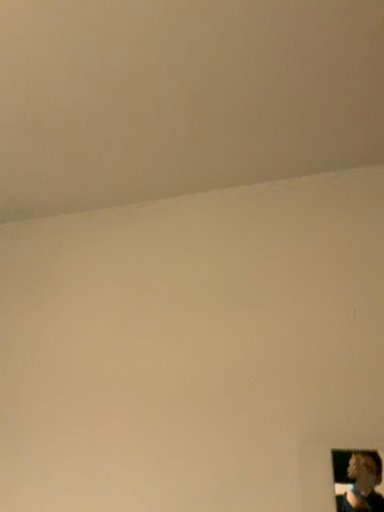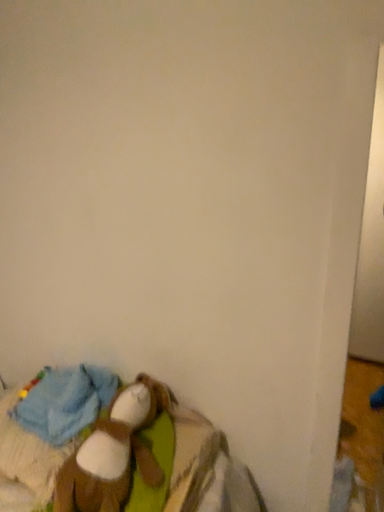
Question: Which way did the camera rotate in the video?

Choices:
 (A) rotated upward
 (B) rotated downward

Answer: (B)